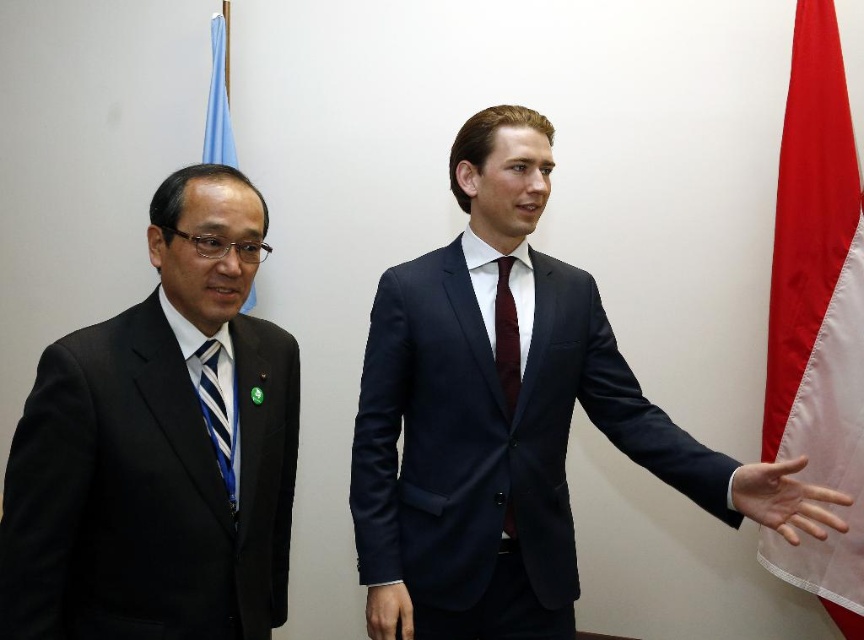
Question: Which of the following is the farthest from the observer?

Choices:
 (A) (403, 625)
 (B) (178, 358)
 (C) (216, 65)

Answer: (C)

Question: Which point is farther to the camera?

Choices:
 (A) (842, 566)
 (B) (218, 42)
 (C) (264, 557)

Answer: (B)

Question: Does dark blue suit at center appear on the right side of burgundy silk tie at center?

Choices:
 (A) yes
 (B) no

Answer: (A)

Question: Which of the following is the closest to the observer?

Choices:
 (A) black suit at left
 (B) smooth skin hand at center

Answer: (A)

Question: Does black suit at left have a larger size compared to blue fabric flag at upper left?

Choices:
 (A) yes
 (B) no

Answer: (A)

Question: Is red/white fabric flag at right to the right of blue striped tie at left from the viewer's perspective?

Choices:
 (A) yes
 (B) no

Answer: (A)